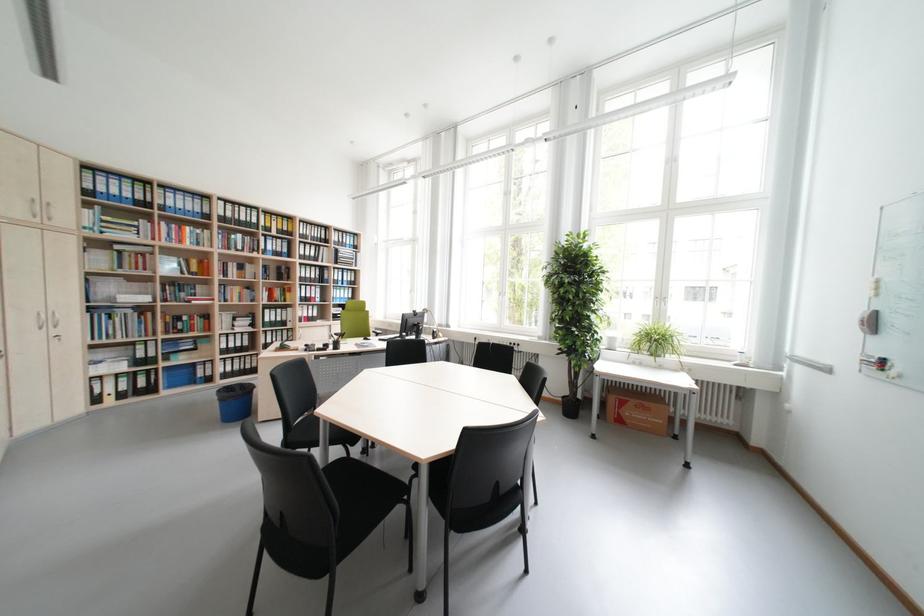
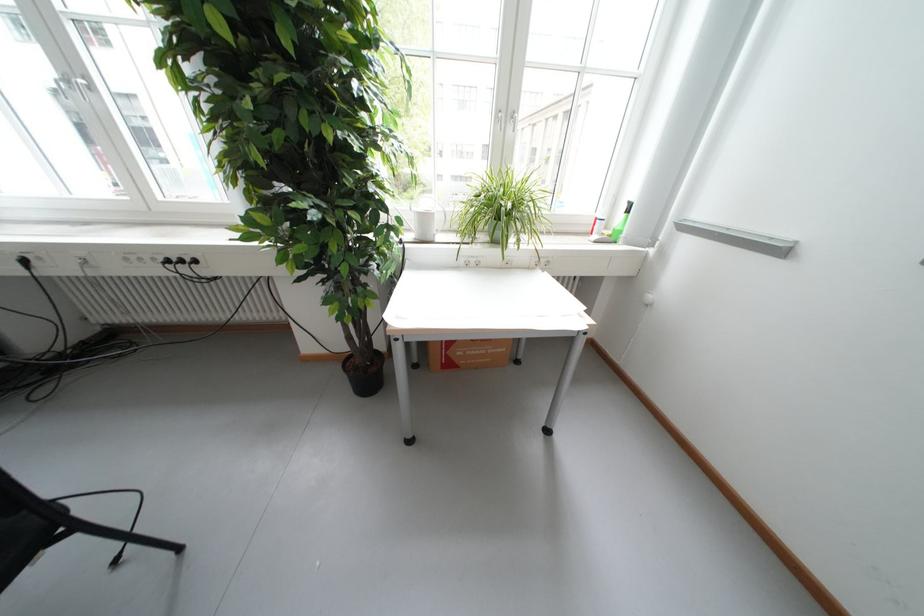
The point at (629,422) is marked in the first image. Where is the corresponding point in the second image?

(458, 366)